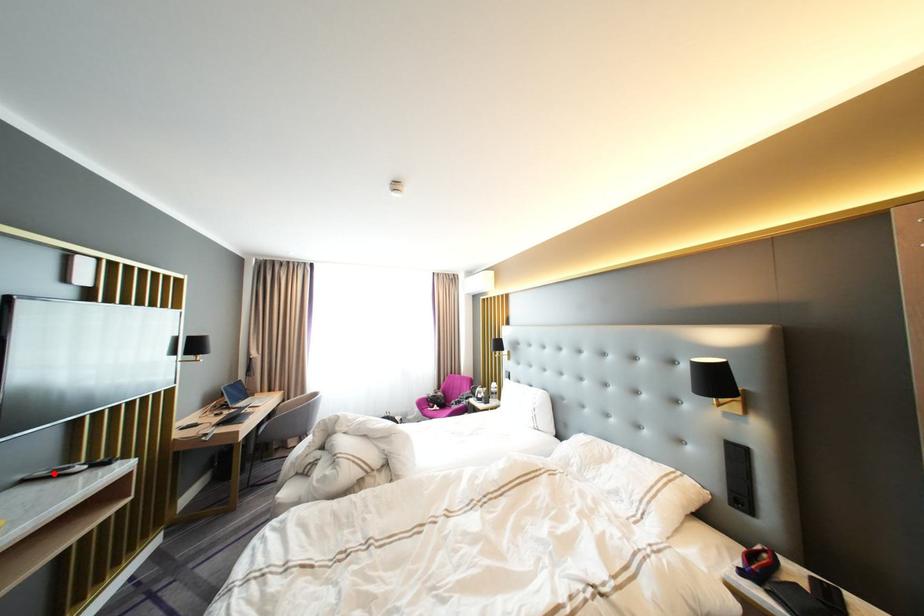
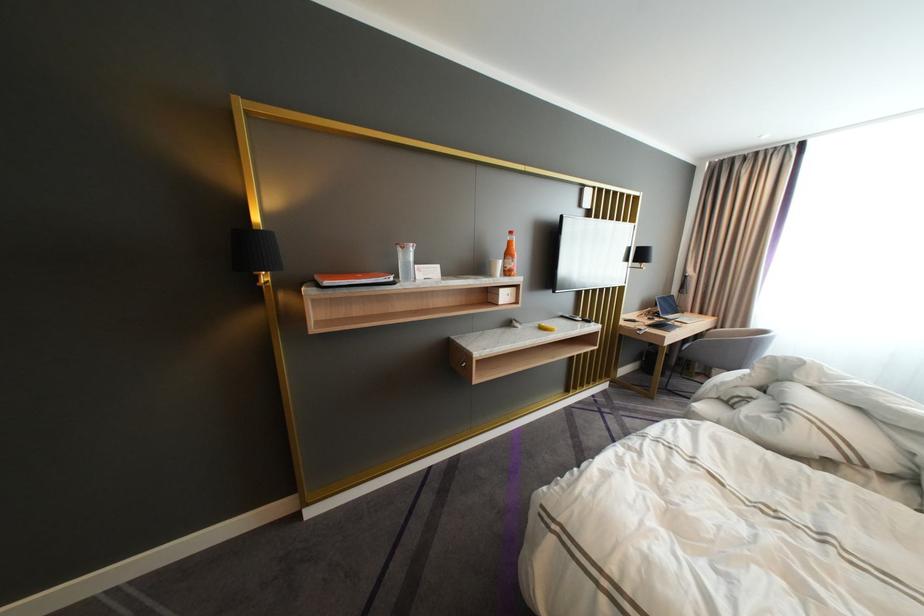
In the second image, find the point that corresponds to the highlighted location in the first image.

(578, 315)